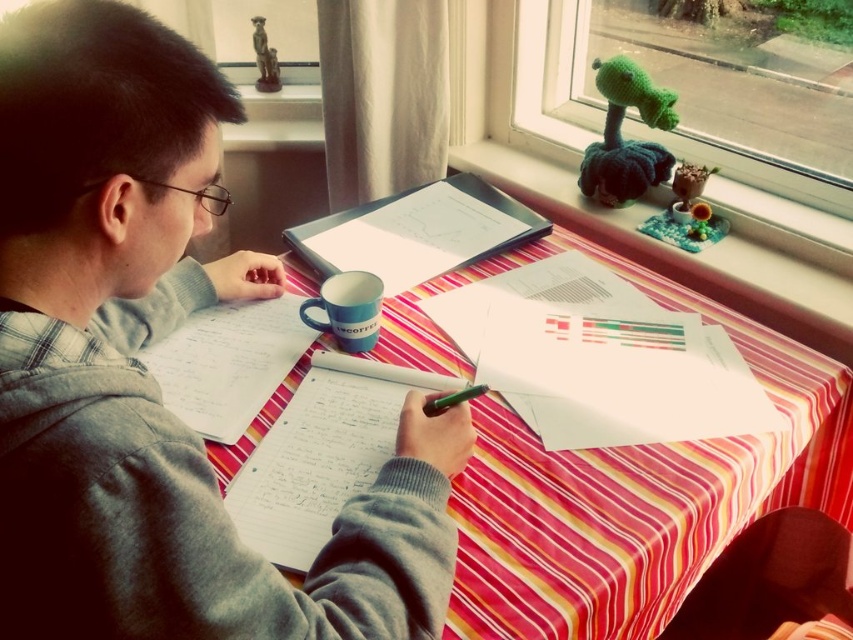
Question: Which object is positioned closest to the blue ceramic mug at center?

Choices:
 (A) green matte pen at center
 (B) striped fabric table at center

Answer: (B)

Question: Is gray fleece hoodie at upper left wider than white paper notebook at center?

Choices:
 (A) yes
 (B) no

Answer: (A)

Question: Is white paper at center closer to the viewer compared to blue ceramic mug at center?

Choices:
 (A) yes
 (B) no

Answer: (B)

Question: Can you confirm if white paper notebook at center is thinner than blue ceramic mug at center?

Choices:
 (A) no
 (B) yes

Answer: (A)

Question: Which of these objects is positioned farthest from the blue ceramic mug at center?

Choices:
 (A) white paper notebook at center
 (B) gray fleece hoodie at upper left
 (C) white paper at center
 (D) striped fabric table at center

Answer: (B)

Question: Which of these objects is positioned closest to the white paper at center?

Choices:
 (A) striped fabric table at center
 (B) gray fleece hoodie at upper left
 (C) green matte pen at center
 (D) blue ceramic mug at center

Answer: (A)